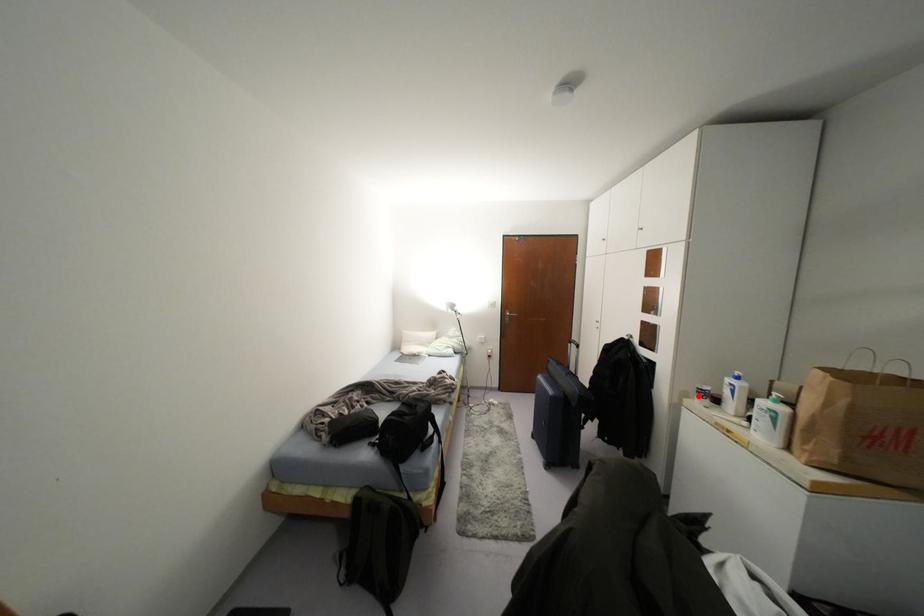
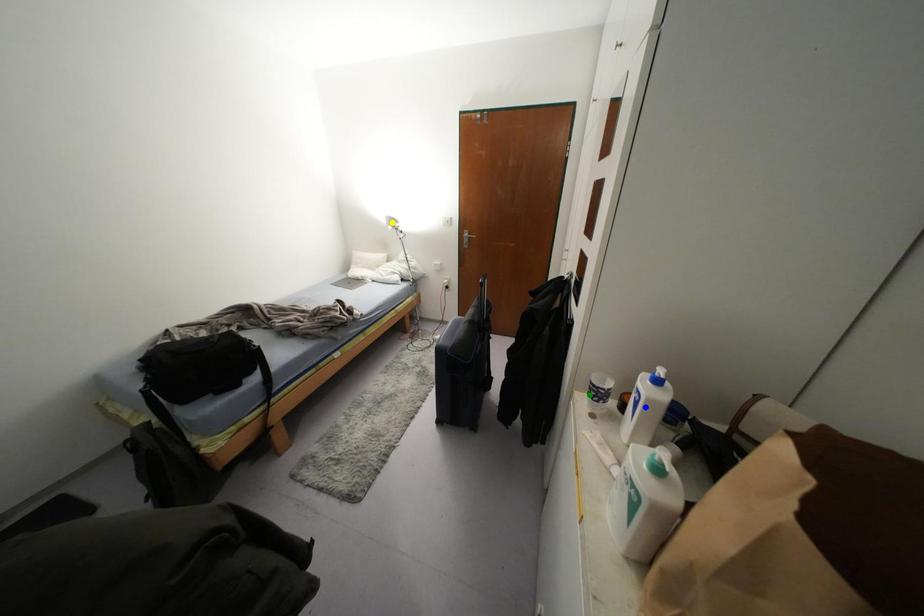
Question: I am providing you with two images of the same scene from different viewpoints. A red point is marked on the first image. You are given multiple points on the second image. Which spot in image 2 lines up with the point in image 1?

Choices:
 (A) blue point
 (B) green point
 (C) yellow point

Answer: (B)